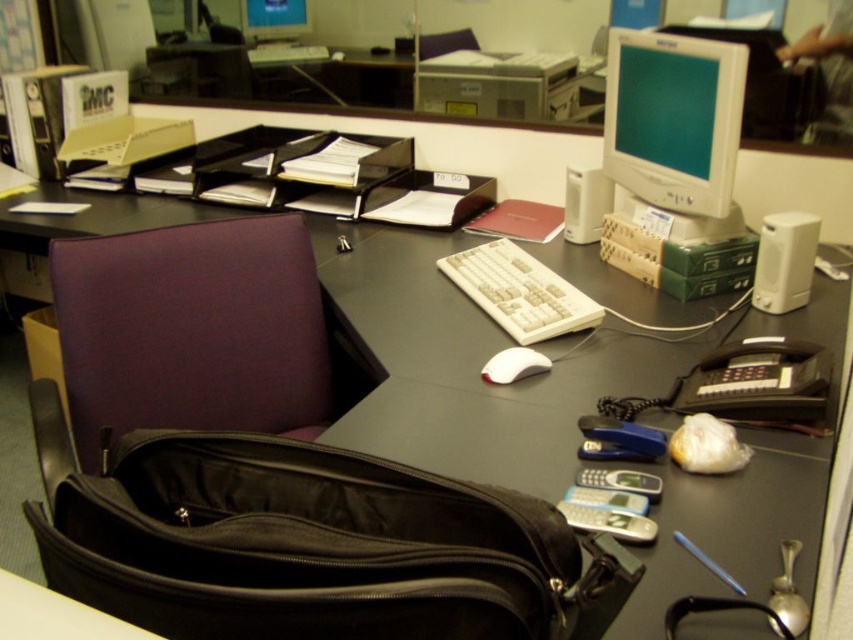
You are a delivery person who just arrived at the office. You need to place a new monitor on the desk, which is 1.2 meters wide. The current desk has a matte plastic monitor at upper right. Is there enough space on the desk to place the new monitor next to the existing one?

The distance between the matte plastic monitor at upper right and the viewer is 1.36 meters, but this does not provide information about the desk space. Without knowing the desk dimensions or the existing monitor placement, it is impossible to determine if there is enough space to place the new monitor next to the existing one.

You are organizing the desk and want to place both the matte plastic monitor at upper right and the matte plastic monitor at upper center on a shelf. The shelf has a height limit of 20 inches. Which monitor should you place first to ensure both fit without exceeding the height limit?

The matte plastic monitor at upper right is bigger than the matte plastic monitor at upper center. Since the bigger monitor takes up more height, you should place the matte plastic monitor at upper center first to accommodate both within the 20 inch limit.

You are organizing the desk and need to move the matte plastic monitor at upper right closer to the matte plastic monitor at upper center. How much distance do you need to reduce between them?

The current distance between the matte plastic monitor at upper right and the matte plastic monitor at upper center is 1.26 meters. To move them closer, you need to reduce this distance by the desired amount, but the exact required reduction isn